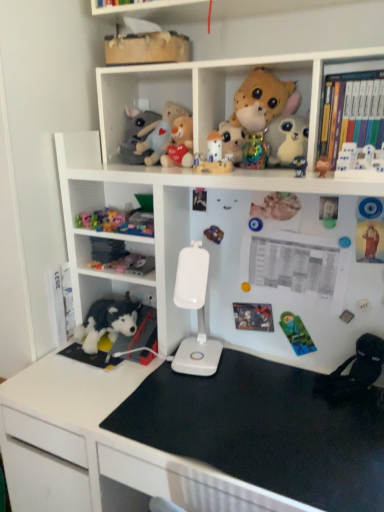
This screenshot has width=384, height=512. In order to click on vacant point above black matte desk at center (from a real-world perspective) in this screenshot , I will do `click(244, 404)`.